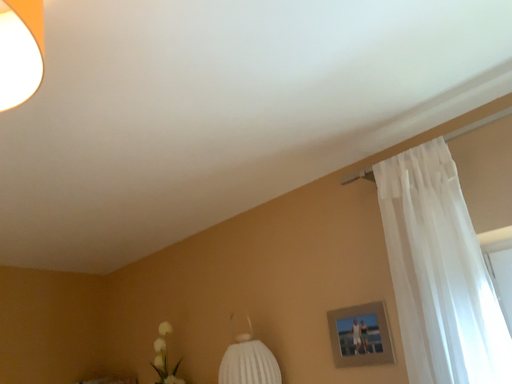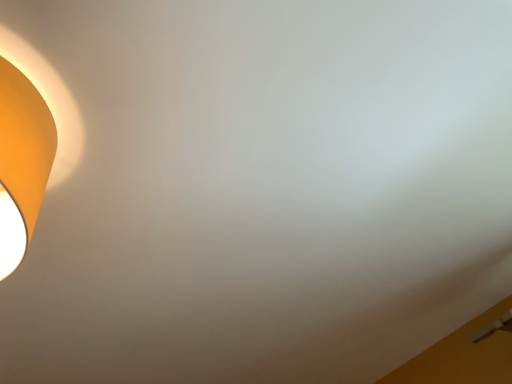
Question: How did the camera likely rotate when shooting the video?

Choices:
 (A) rotated left
 (B) rotated right

Answer: (A)